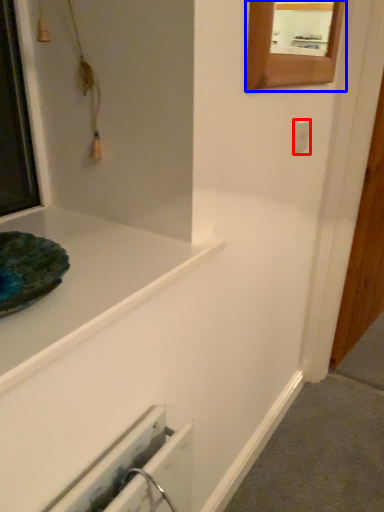
Question: Which point is closer to the camera, electric outlet (highlighted by a red box) or mirror (highlighted by a blue box)?

Choices:
 (A) electric outlet
 (B) mirror

Answer: (B)